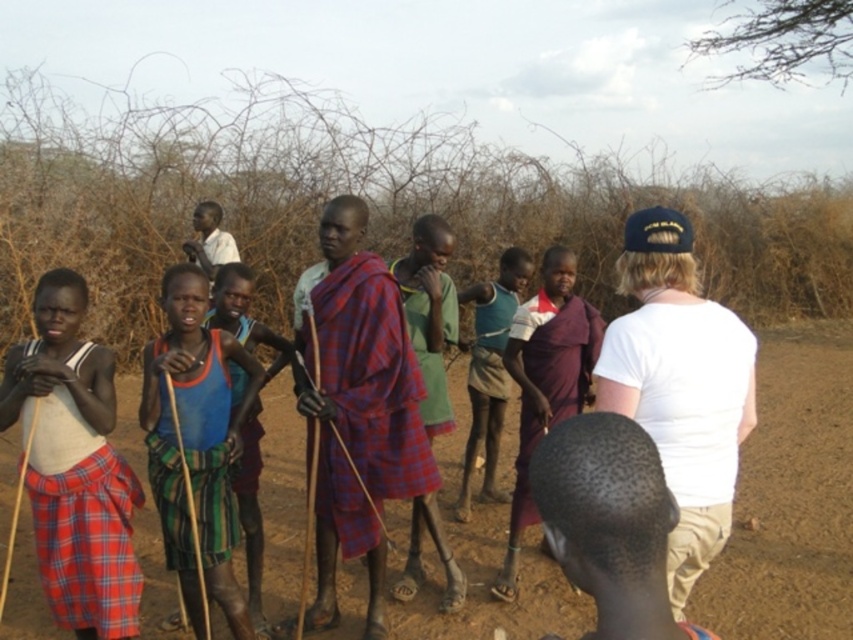
Who is positioned more to the left, brown dirt field at center or blue-green fabric at center?

From the viewer's perspective, blue-green fabric at center appears more on the left side.

How distant is brown dirt field at center from blue-green fabric at center?

brown dirt field at center and blue-green fabric at center are 2.01 meters apart from each other.

Does point (4, 449) come in front of point (235, 458)?

No, it is behind (235, 458).

Identify the location of brown dirt field at center. (790, 497).

Is point (223, 355) positioned behind point (474, 378)?

No, (223, 355) is closer to viewer.

Is point (233, 502) positioned in front of point (497, 353)?

Yes, it is in front of point (497, 353).

Locate an element on the screen. blue-green fabric at center is located at coordinates (196, 444).

Where is `brown dirt field at center`? The height and width of the screenshot is (640, 853). brown dirt field at center is located at coordinates pos(790,497).

Can you confirm if brown dirt field at center is positioned below teal fabric shirt at center?

Yes, brown dirt field at center is below teal fabric shirt at center.

Does point (780, 525) come in front of point (486, 346)?

Yes.

You are a GUI agent. You are given a task and a screenshot of the screen. Output one action in this format:
    pyautogui.click(x=<x>, y=<y>)
    Task: Click on the brown dirt field at center
    This screenshot has width=853, height=640.
    Given the screenshot: What is the action you would take?
    pyautogui.click(x=790, y=497)